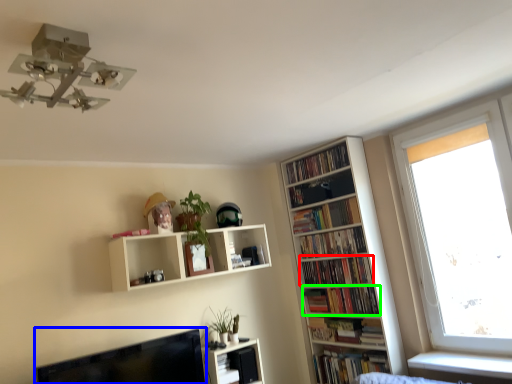
Question: Which object is positioned farthest from book (highlighted by a red box)? Select from computer monitor (highlighted by a blue box) and book (highlighted by a green box).

Choices:
 (A) computer monitor
 (B) book

Answer: (A)